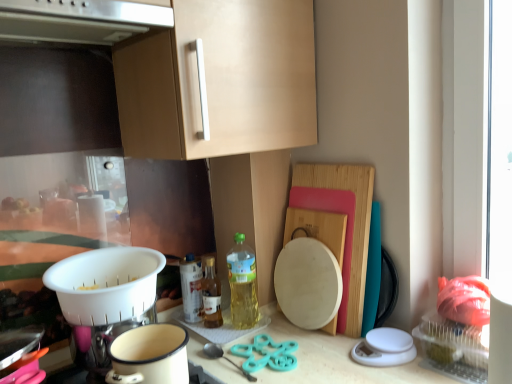
Question: Considering the positions of translucent glass bottle at center, the second bottle positioned from the right, and white plastic colander at lower left in the image, is translucent glass bottle at center, the second bottle positioned from the right, wider or thinner than white plastic colander at lower left?

Choices:
 (A) thin
 (B) wide

Answer: (A)

Question: Considering the positions of point (206, 264) and point (126, 258), is point (206, 264) closer or farther from the camera than point (126, 258)?

Choices:
 (A) closer
 (B) farther

Answer: (B)

Question: Estimate the real-world distances between objects in this image. Which object is closer to the translucent plastic bottle at center, the 1th bottle positioned from the right?

Choices:
 (A) white enamel pot at lower center
 (B) teal plastic scissors at center
 (C) wooden cutting board at right
 (D) translucent glass bottle at center, the second bottle positioned from the right
 (E) white plastic colander at lower left

Answer: (D)

Question: Based on their relative distances, which object is nearer to the teal plastic scissors at center?

Choices:
 (A) satin silver exhaust hood at upper center
 (B) translucent plastic bottle at center, the 1th bottle positioned from the right
 (C) translucent glass bottle at center, the second bottle positioned from the right
 (D) white plastic colander at lower left
 (E) white enamel pot at lower center

Answer: (C)